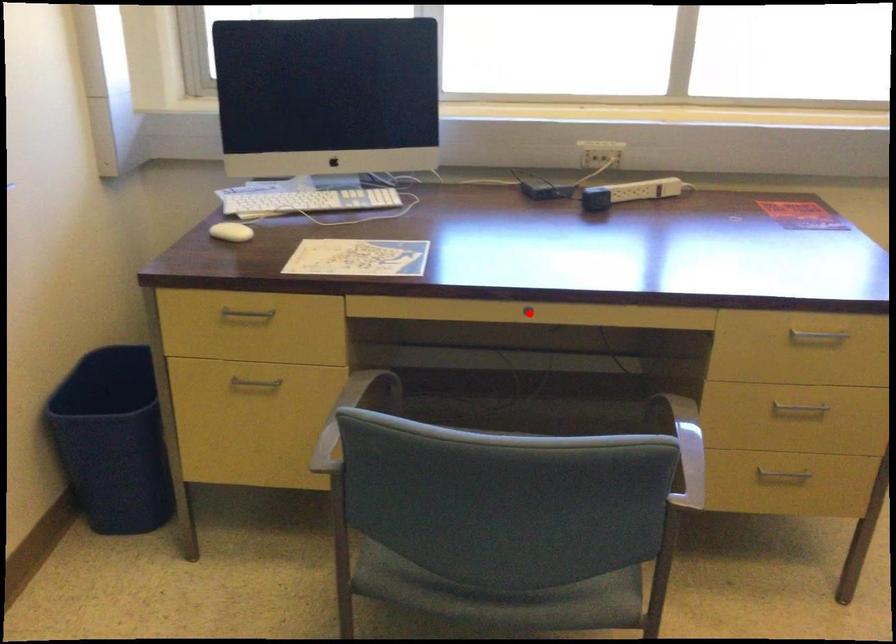
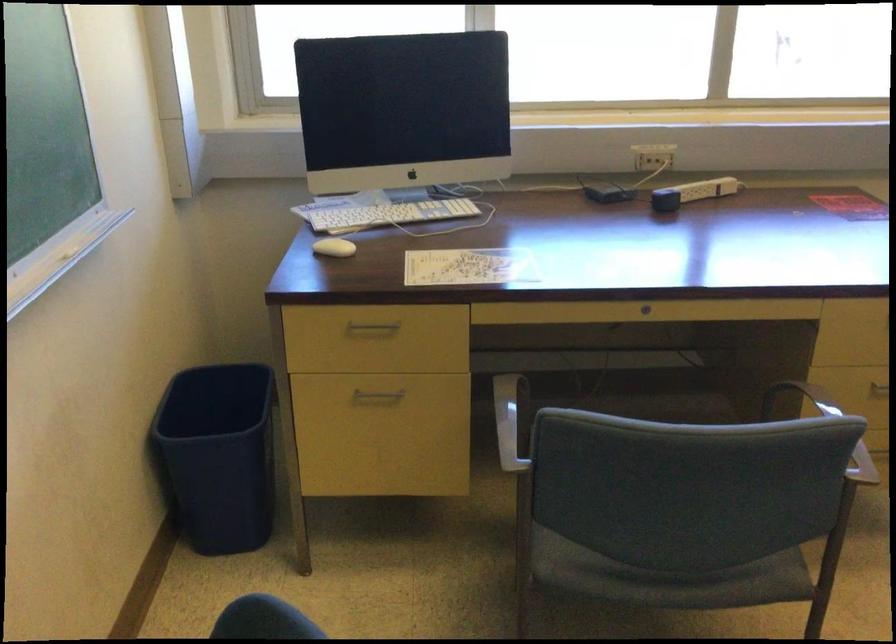
The point at the highlighted location is marked in the first image. Where is the corresponding point in the second image?

(645, 308)